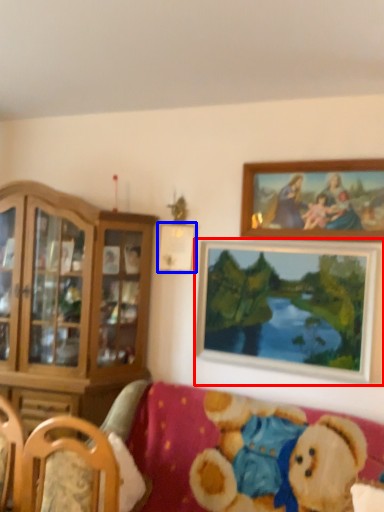
Question: Among these objects, which one is nearest to the camera, picture frame (highlighted by a red box) or picture frame (highlighted by a blue box)?

Choices:
 (A) picture frame
 (B) picture frame

Answer: (A)